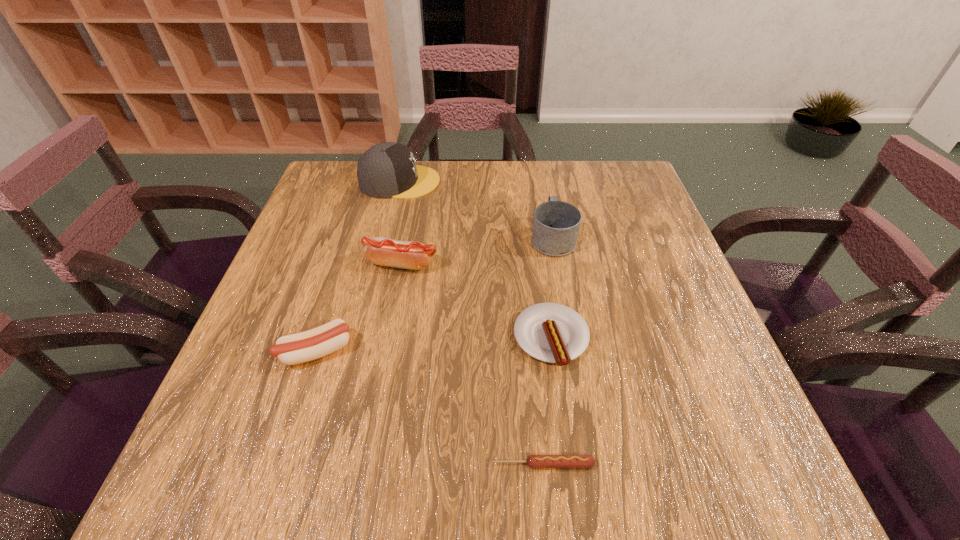
Where is `sausage at the left edge`? This screenshot has height=540, width=960. sausage at the left edge is located at coordinates tap(309, 345).

You are a GUI agent. You are given a task and a screenshot of the screen. Output one action in this format:
    pyautogui.click(x=<x>, y=<y>)
    Task: Click on the object that is positioned at the far left corner
    The width and height of the screenshot is (960, 540).
    Given the screenshot: What is the action you would take?
    pyautogui.click(x=386, y=170)

This screenshot has height=540, width=960. Identify the location of free space at the far edge. (x=469, y=164).

Image resolution: width=960 pixels, height=540 pixels. I want to click on blank area at the near edge, so click(x=516, y=481).

In order to click on vacant space at the left edge of the desktop in this screenshot , I will do [273, 360].

Find the location of a particular element. This screenshot has width=960, height=540. vacant space at the right edge of the desktop is located at coordinates (638, 243).

What are the coordinates of `free region at the far left corner of the desktop` in the screenshot? It's located at (327, 180).

Locate an element on the screen. free region at the near left corner of the desktop is located at coordinates (247, 461).

The height and width of the screenshot is (540, 960). Find the location of `free space at the far right corner of the desktop`. free space at the far right corner of the desktop is located at coordinates (636, 201).

Identify the location of empty location between the second tallest sausage and the second tallest object. (435, 294).